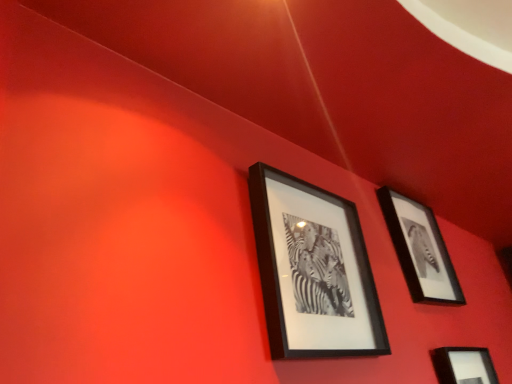
What do you see at coordinates (420, 249) in the screenshot?
I see `black matte picture frame at upper right, marked as the second picture frame in a right-to-left arrangement` at bounding box center [420, 249].

The height and width of the screenshot is (384, 512). Describe the element at coordinates (464, 365) in the screenshot. I see `black matte picture frame at lower right, arranged as the first picture frame when viewed from the right` at that location.

In order to click on black matte picture frame at upper right, which is counted as the second picture frame, starting from the left in this screenshot , I will do `click(420, 249)`.

Locate an element on the screen. The width and height of the screenshot is (512, 384). the 2nd picture frame located above the black matte picture frame at lower right, arranged as the first picture frame when viewed from the right (from a real-world perspective) is located at coordinates (420, 249).

Which object is more forward, black matte picture frame at upper right, which is counted as the second picture frame, starting from the left, or black matte picture frame at lower right, arranged as the first picture frame when viewed from the right?

black matte picture frame at lower right, arranged as the first picture frame when viewed from the right, is closer to the camera.

How different are the orientations of black matte picture frame at upper right, which is counted as the second picture frame, starting from the left, and black matte picture frame at lower right, placed as the 3th picture frame when sorted from left to right, in degrees?

They differ by 0.0518 degrees in their facing directions.

Based on the photo, are black matte picture frame at upper right, which is counted as the second picture frame, starting from the left, and black matte picture frame at upper center, placed as the first picture frame when sorted from left to right, located far from each other?

No, there isn't a large distance between black matte picture frame at upper right, which is counted as the second picture frame, starting from the left, and black matte picture frame at upper center, placed as the first picture frame when sorted from left to right.

Image resolution: width=512 pixels, height=384 pixels. Identify the location of picture frame that is the 1st one when counting rightward from the black matte picture frame at upper center, placed as the first picture frame when sorted from left to right. (420, 249).

Is black matte picture frame at upper right, which is counted as the second picture frame, starting from the left, inside or outside of black matte picture frame at upper center, placed as the first picture frame when sorted from left to right?

black matte picture frame at upper right, which is counted as the second picture frame, starting from the left, cannot be found inside black matte picture frame at upper center, placed as the first picture frame when sorted from left to right.

Which is more to the right, black matte picture frame at upper right, which is counted as the second picture frame, starting from the left, or black matte picture frame at upper center, placed as the first picture frame when sorted from left to right?

black matte picture frame at upper right, which is counted as the second picture frame, starting from the left.

Considering the relative sizes of black matte picture frame at lower right, arranged as the first picture frame when viewed from the right, and black matte picture frame at upper center, marked as the 3th picture frame in a right-to-left arrangement, in the image provided, is black matte picture frame at lower right, arranged as the first picture frame when viewed from the right, shorter than black matte picture frame at upper center, marked as the 3th picture frame in a right-to-left arrangement,?

Yes.

Is point (461, 361) positioned after point (344, 283)?

Yes, point (461, 361) is farther from viewer.

In the scene shown: Would you consider black matte picture frame at lower right, placed as the 3th picture frame when sorted from left to right, to be distant from black matte picture frame at upper center, marked as the 3th picture frame in a right-to-left arrangement?

Actually, black matte picture frame at lower right, placed as the 3th picture frame when sorted from left to right, and black matte picture frame at upper center, marked as the 3th picture frame in a right-to-left arrangement, are a little close together.

How different are the orientations of black matte picture frame at lower right, placed as the 3th picture frame when sorted from left to right, and black matte picture frame at upper center, placed as the first picture frame when sorted from left to right, in degrees?

There is a 0.179-degree angle between the facing directions of black matte picture frame at lower right, placed as the 3th picture frame when sorted from left to right, and black matte picture frame at upper center, placed as the first picture frame when sorted from left to right.

Looking at this image, can you confirm if black matte picture frame at lower right, arranged as the first picture frame when viewed from the right, is taller than black matte picture frame at upper right, marked as the second picture frame in a right-to-left arrangement?

No.

Looking at this image, from the image's perspective, is black matte picture frame at lower right, arranged as the first picture frame when viewed from the right, below black matte picture frame at upper right, which is counted as the second picture frame, starting from the left?

Yes, from the image's perspective, black matte picture frame at lower right, arranged as the first picture frame when viewed from the right, is beneath black matte picture frame at upper right, which is counted as the second picture frame, starting from the left.

Looking at this image, which of these two, black matte picture frame at lower right, arranged as the first picture frame when viewed from the right, or black matte picture frame at upper right, which is counted as the second picture frame, starting from the left, is thinner?

With smaller width is black matte picture frame at upper right, which is counted as the second picture frame, starting from the left.

Which is correct: black matte picture frame at lower right, placed as the 3th picture frame when sorted from left to right, is inside black matte picture frame at upper right, which is counted as the second picture frame, starting from the left, or outside of it?

black matte picture frame at lower right, placed as the 3th picture frame when sorted from left to right, exists outside the volume of black matte picture frame at upper right, which is counted as the second picture frame, starting from the left.

Does black matte picture frame at upper center, placed as the first picture frame when sorted from left to right, appear on the right side of black matte picture frame at lower right, arranged as the first picture frame when viewed from the right?

No.

Is the depth of black matte picture frame at upper center, marked as the 3th picture frame in a right-to-left arrangement, greater than that of black matte picture frame at lower right, arranged as the first picture frame when viewed from the right?

No, black matte picture frame at upper center, marked as the 3th picture frame in a right-to-left arrangement, is in front of black matte picture frame at lower right, arranged as the first picture frame when viewed from the right.

Is black matte picture frame at upper center, marked as the 3th picture frame in a right-to-left arrangement, directly adjacent to black matte picture frame at lower right, arranged as the first picture frame when viewed from the right?

No.

From a real-world perspective, is black matte picture frame at upper center, placed as the first picture frame when sorted from left to right, physically located above or below black matte picture frame at lower right, placed as the 3th picture frame when sorted from left to right?

black matte picture frame at upper center, placed as the first picture frame when sorted from left to right, is situated higher than black matte picture frame at lower right, placed as the 3th picture frame when sorted from left to right, in the real world.

Is point (346, 230) positioned after point (415, 250)?

No, (346, 230) is in front of (415, 250).

Which object is further away from the camera, black matte picture frame at upper center, marked as the 3th picture frame in a right-to-left arrangement, or black matte picture frame at upper right, which is counted as the second picture frame, starting from the left?

black matte picture frame at upper right, which is counted as the second picture frame, starting from the left, is behind.

Is black matte picture frame at upper center, placed as the first picture frame when sorted from left to right, oriented away from black matte picture frame at upper right, marked as the second picture frame in a right-to-left arrangement?

black matte picture frame at upper center, placed as the first picture frame when sorted from left to right, is not turned away from black matte picture frame at upper right, marked as the second picture frame in a right-to-left arrangement.

From the image's perspective, which picture frame is the 1st one above the black matte picture frame at lower right, arranged as the first picture frame when viewed from the right? Please provide its 2D coordinates.

[(420, 249)]

From a real-world perspective, which picture frame is the 1st one underneath the black matte picture frame at upper right, which is counted as the second picture frame, starting from the left? Please provide its 2D coordinates.

[(313, 270)]

Which object lies nearer to the anchor point black matte picture frame at upper right, marked as the second picture frame in a right-to-left arrangement, black matte picture frame at upper center, placed as the first picture frame when sorted from left to right, or black matte picture frame at lower right, placed as the 3th picture frame when sorted from left to right?

black matte picture frame at lower right, placed as the 3th picture frame when sorted from left to right, lies closer to black matte picture frame at upper right, marked as the second picture frame in a right-to-left arrangement, than the other object.

When comparing their distances from black matte picture frame at lower right, arranged as the first picture frame when viewed from the right, does black matte picture frame at upper right, which is counted as the second picture frame, starting from the left, or black matte picture frame at upper center, placed as the first picture frame when sorted from left to right, seem further?

black matte picture frame at upper center, placed as the first picture frame when sorted from left to right.

Considering their positions, is black matte picture frame at upper right, marked as the second picture frame in a right-to-left arrangement, positioned closer to black matte picture frame at upper center, placed as the first picture frame when sorted from left to right, than black matte picture frame at lower right, arranged as the first picture frame when viewed from the right?

The object closer to black matte picture frame at upper center, placed as the first picture frame when sorted from left to right, is black matte picture frame at upper right, marked as the second picture frame in a right-to-left arrangement.

From the image, which object appears to be farther from black matte picture frame at upper center, marked as the 3th picture frame in a right-to-left arrangement, black matte picture frame at lower right, arranged as the first picture frame when viewed from the right, or black matte picture frame at upper right, marked as the second picture frame in a right-to-left arrangement?

black matte picture frame at lower right, arranged as the first picture frame when viewed from the right, lies further to black matte picture frame at upper center, marked as the 3th picture frame in a right-to-left arrangement, than the other object.

Looking at the image, which one is located closer to black matte picture frame at upper right, marked as the second picture frame in a right-to-left arrangement, black matte picture frame at lower right, placed as the 3th picture frame when sorted from left to right, or black matte picture frame at upper center, marked as the 3th picture frame in a right-to-left arrangement?

black matte picture frame at lower right, placed as the 3th picture frame when sorted from left to right, is positioned closer to the anchor black matte picture frame at upper right, marked as the second picture frame in a right-to-left arrangement.

When comparing their distances from black matte picture frame at lower right, placed as the 3th picture frame when sorted from left to right, does black matte picture frame at upper center, placed as the first picture frame when sorted from left to right, or black matte picture frame at upper right, which is counted as the second picture frame, starting from the left, seem closer?

black matte picture frame at upper right, which is counted as the second picture frame, starting from the left.

Identify the location of picture frame between black matte picture frame at upper center, placed as the first picture frame when sorted from left to right, and black matte picture frame at upper right, which is counted as the second picture frame, starting from the left, along the z-axis. (464, 365).